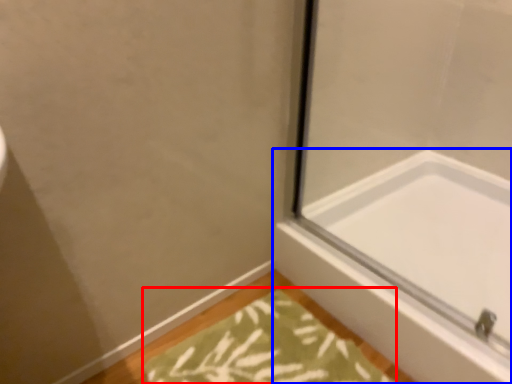
Question: Which object appears farthest to the camera in this image, bath mat (highlighted by a red box) or bathtub (highlighted by a blue box)?

Choices:
 (A) bath mat
 (B) bathtub

Answer: (B)